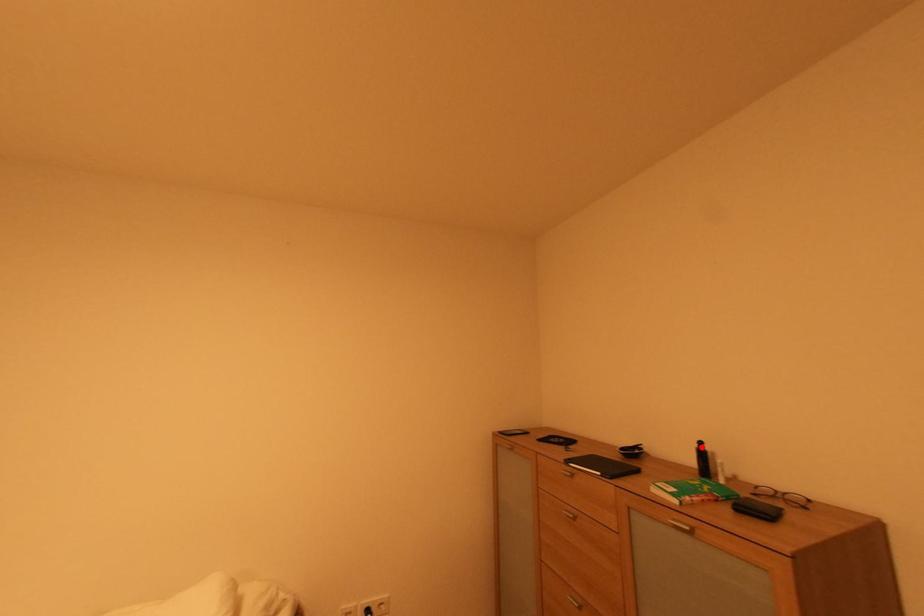
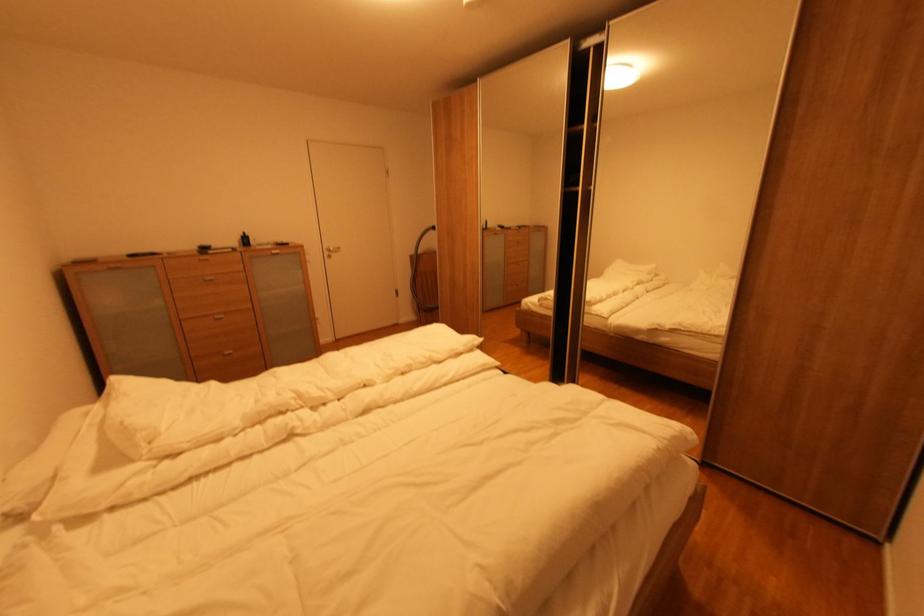
Find the pixel in the second image that matches the highlighted location in the first image.

(248, 237)